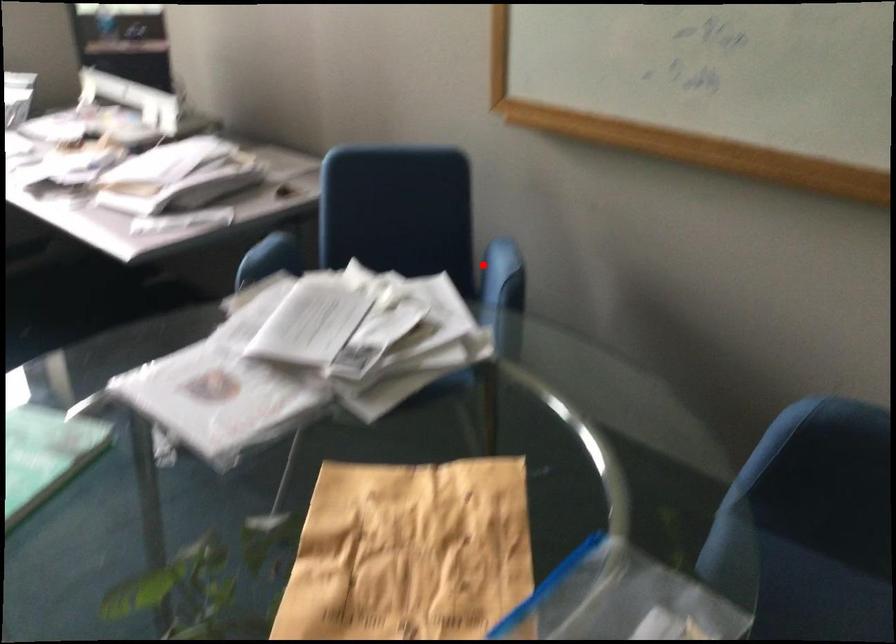
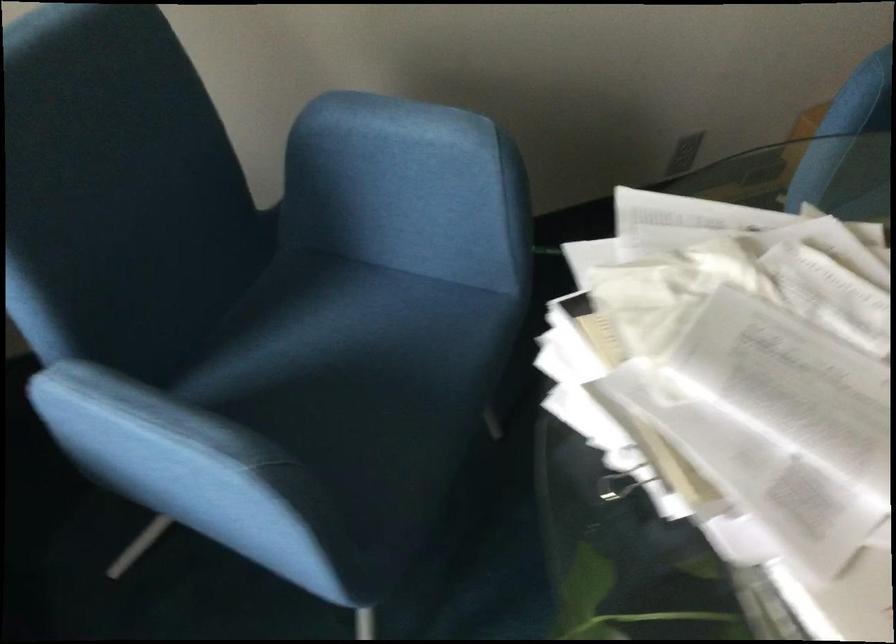
In the second image, find the point that corresponds to the highlighted location in the first image.

(394, 140)